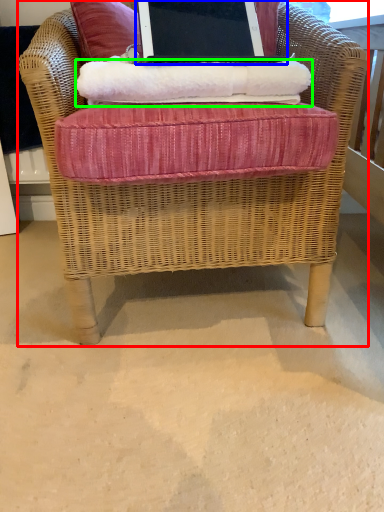
Question: Which object is positioned closest to chair (highlighted by a red box)? Select from laptop (highlighted by a blue box) and material (highlighted by a green box).

Choices:
 (A) laptop
 (B) material

Answer: (B)